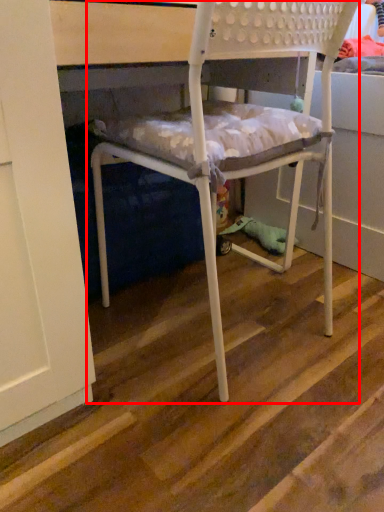
Question: Considering the relative positions of chair (annotated by the red box) and stair in the image provided, where is chair (annotated by the red box) located with respect to the staircase?

Choices:
 (A) left
 (B) right

Answer: (A)